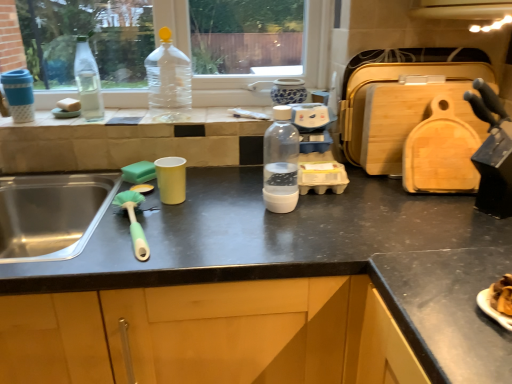
You are a GUI agent. You are given a task and a screenshot of the screen. Output one action in this format:
    pyautogui.click(x=<x>, y=<y>)
    Task: Click on the spots to the right of white sponge at left, the first food in the top-to-bottom sequence
    
    Given the screenshot: What is the action you would take?
    pyautogui.click(x=115, y=115)